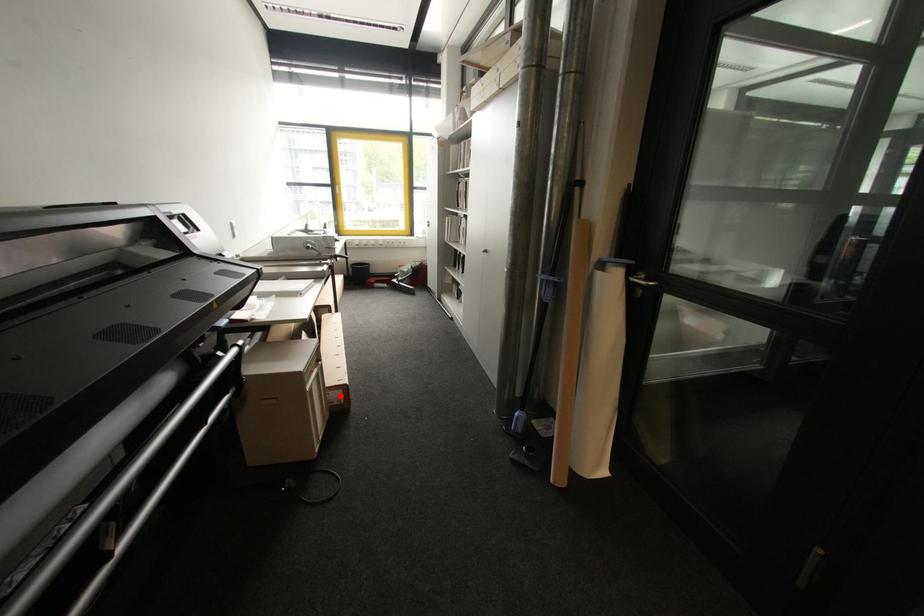
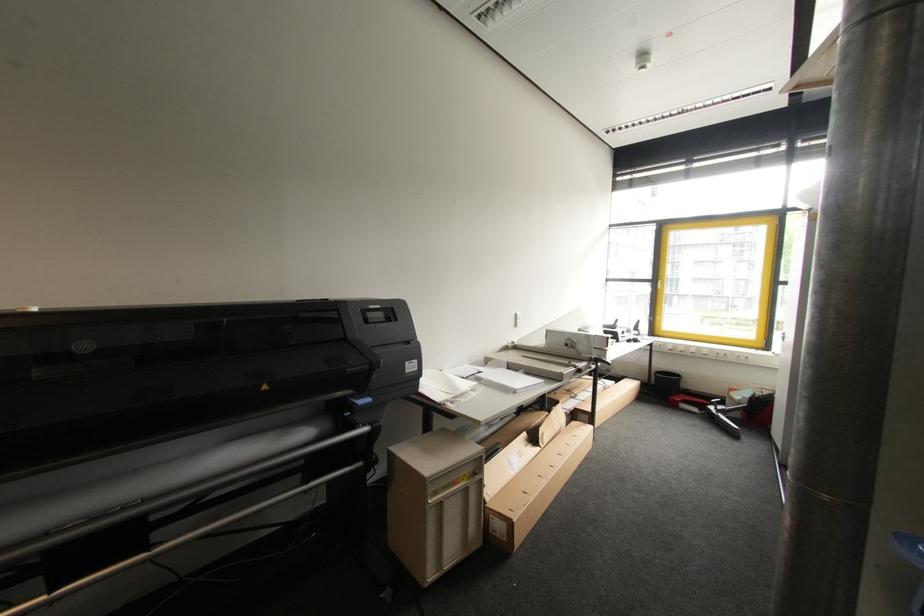
In the second image, find the point that corresponds to the highlighted location in the first image.

(503, 527)